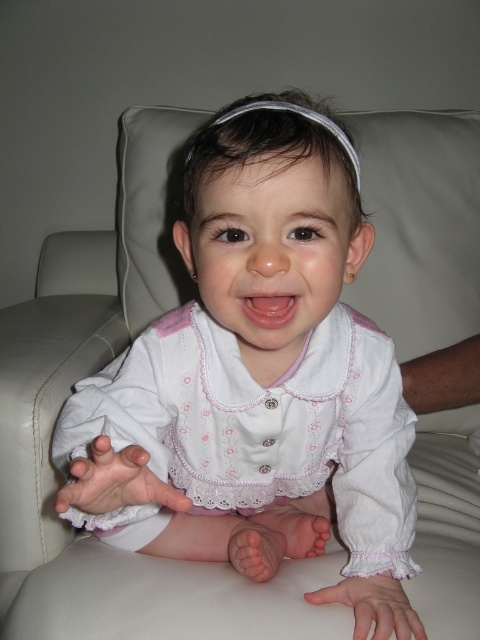
Question: Which object is positioned farthest from the white lace hand at lower center?

Choices:
 (A) white lace hand at lower left
 (B) white fabric headband at upper center

Answer: (B)

Question: Does white lace baby at center appear on the left side of white lace hand at lower left?

Choices:
 (A) yes
 (B) no

Answer: (B)

Question: Is white lace baby at center thinner than white fabric headband at upper center?

Choices:
 (A) yes
 (B) no

Answer: (B)

Question: Can you confirm if white lace baby at center is smaller than white lace hand at lower center?

Choices:
 (A) no
 (B) yes

Answer: (A)

Question: Which object is the farthest from the white lace baby at center?

Choices:
 (A) white lace hand at lower center
 (B) white fabric headband at upper center
 (C) white lace hand at lower left

Answer: (B)

Question: Estimate the real-world distances between objects in this image. Which object is farther from the white lace hand at lower center?

Choices:
 (A) white fabric headband at upper center
 (B) white lace hand at lower left

Answer: (A)